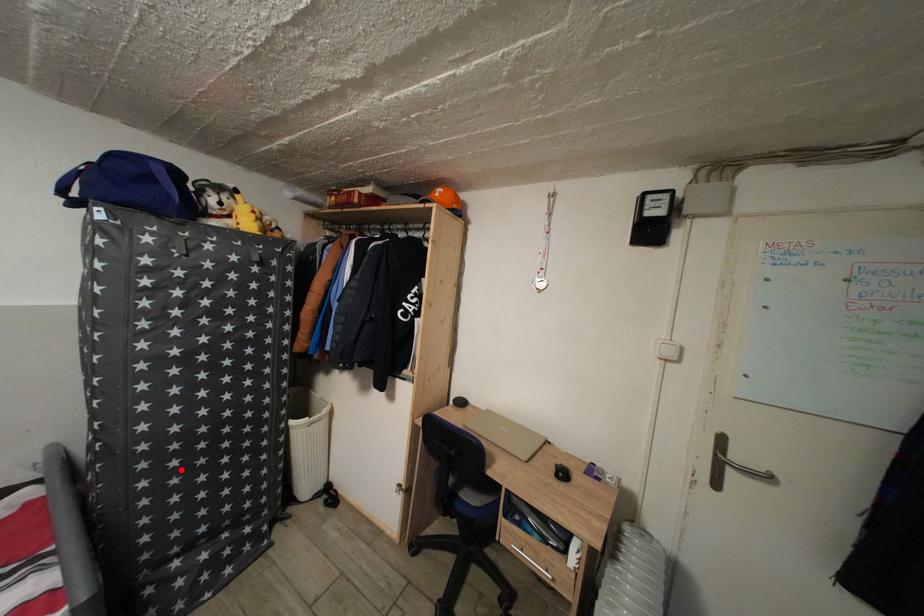
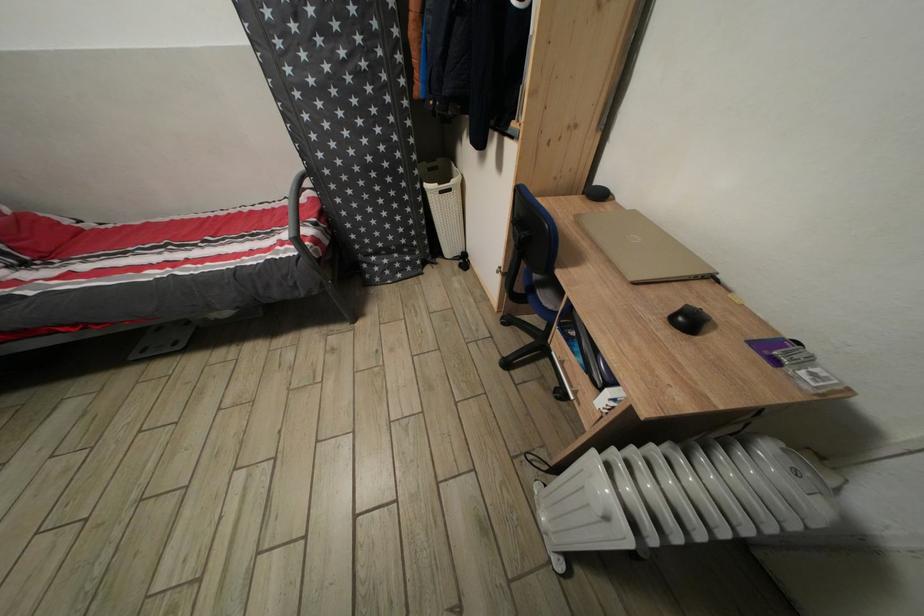
In the second image, find the point that corresponds to the highlighted location in the first image.

(357, 198)